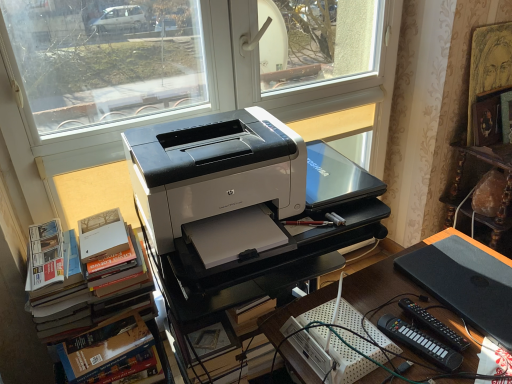
The width and height of the screenshot is (512, 384). Identify the location of unoccupied space behind black plastic remote control at lower right, which is the 1th equipment in right-to-left order. click(x=403, y=289).